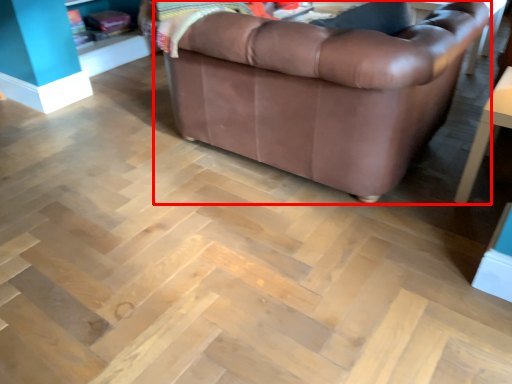
Question: From the image's perspective, what is the correct spatial positioning of studio couch (annotated by the red box) in reference to table?

Choices:
 (A) below
 (B) above

Answer: (B)